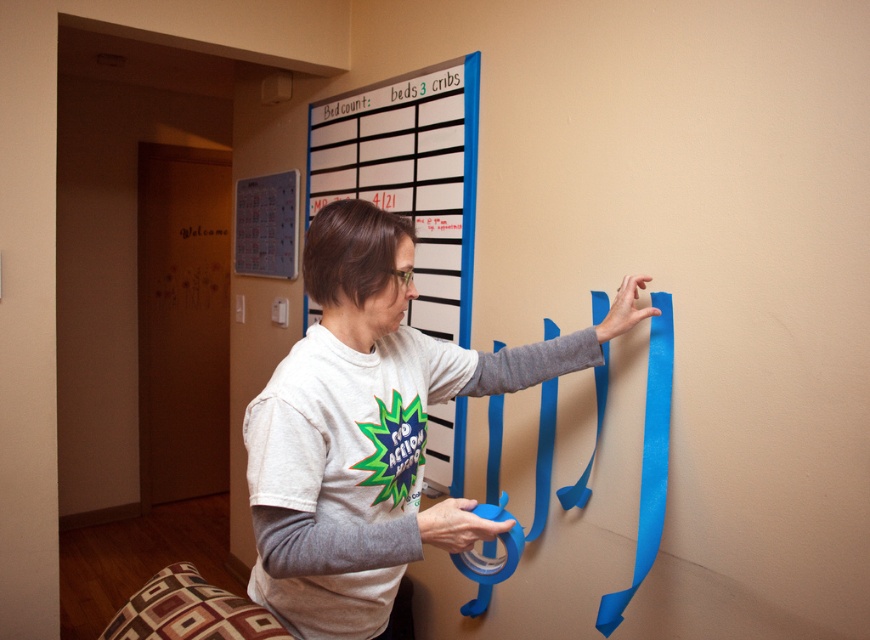
Question: Is blue plastic board at upper center thinner than blue matte tape at center?

Choices:
 (A) no
 (B) yes

Answer: (A)

Question: Which of the following is the farthest from the observer?

Choices:
 (A) blue matte tape at center
 (B) matte blue tape at center

Answer: (A)

Question: Does matte blue tape at center appear on the left side of blue matte tape at center?

Choices:
 (A) yes
 (B) no

Answer: (A)

Question: Estimate the real-world distances between objects in this image. Which object is farther from the matte blue tape at center?

Choices:
 (A) blue plastic board at upper center
 (B) blue matte tape at center

Answer: (A)

Question: Is blue plastic board at upper center thinner than blue matte tape at center?

Choices:
 (A) yes
 (B) no

Answer: (B)

Question: Which object appears farthest from the camera in this image?

Choices:
 (A) matte blue tape at center
 (B) blue plastic board at upper center

Answer: (B)